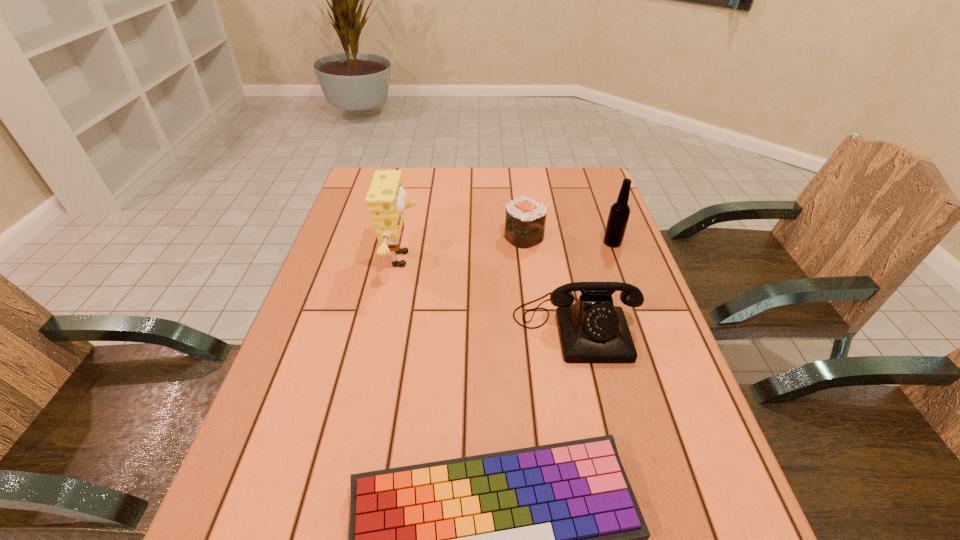
You are a GUI agent. You are given a task and a screenshot of the screen. Output one action in this format:
    pyautogui.click(x=<x>, y=<y>)
    Task: Click on the telephone located at the right edge
    This screenshot has width=960, height=540.
    Given the screenshot: What is the action you would take?
    pyautogui.click(x=592, y=330)

In the image, there is a desktop. Identify the location of free space at the far edge. (420, 172).

The image size is (960, 540). Find the location of `free spot at the left edge of the desktop`. free spot at the left edge of the desktop is located at coordinates (268, 525).

The width and height of the screenshot is (960, 540). In order to click on free space at the right edge in this screenshot , I will do `click(739, 517)`.

Image resolution: width=960 pixels, height=540 pixels. I want to click on vacant space at the far left corner of the desktop, so [358, 190].

Locate an element on the screen. vacant space at the far right corner is located at coordinates (578, 170).

At what (x,y) coordinates should I click in order to perform the action: click on vacant area that lies between the beer bottle and the sushi. Please return your answer as a coordinate pair (x, y). Image resolution: width=960 pixels, height=540 pixels. Looking at the image, I should click on (568, 240).

In order to click on free area in between the telephone and the sponge in this screenshot , I will do `click(490, 292)`.

Where is `empty space that is in between the second tallest object and the sponge`? This screenshot has height=540, width=960. empty space that is in between the second tallest object and the sponge is located at coordinates (508, 251).

Locate an element on the screen. The image size is (960, 540). vacant region between the beer bottle and the sponge is located at coordinates (508, 251).